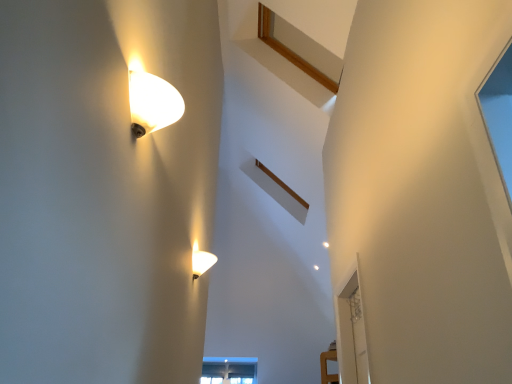
Question: From a real-world perspective, relative to matte glass lamp at upper left, the second lamp positioned from the back, is matte white lamp at lower center, placed as the 1th lamp when sorted from back to front, vertically above or below?

Choices:
 (A) below
 (B) above

Answer: (B)

Question: Is matte white lamp at lower center, acting as the first lamp starting from the bottom, in front of or behind matte glass lamp at upper left, which is the 1th lamp in front-to-back order, in the image?

Choices:
 (A) behind
 (B) front

Answer: (A)

Question: Which is farther from the matte white lamp at lower center, acting as the first lamp starting from the bottom?

Choices:
 (A) transparent glass door at right
 (B) matte glass lamp at upper left, the second lamp positioned from the back

Answer: (B)

Question: Which object is positioned closest to the transparent glass door at right?

Choices:
 (A) matte glass lamp at upper left, marked as the 1th lamp in a top-to-bottom arrangement
 (B) matte white lamp at lower center, which is counted as the 2th lamp, starting from the top

Answer: (B)